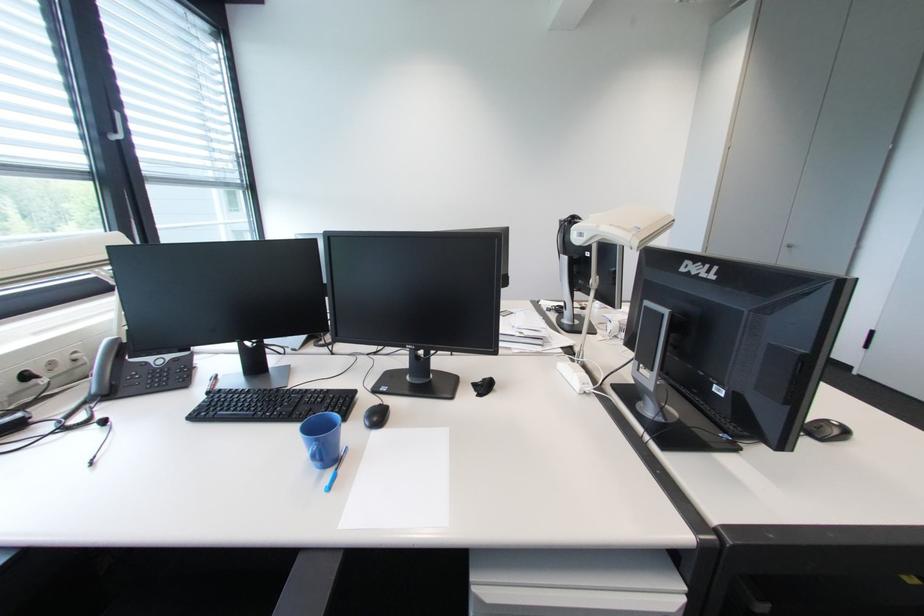
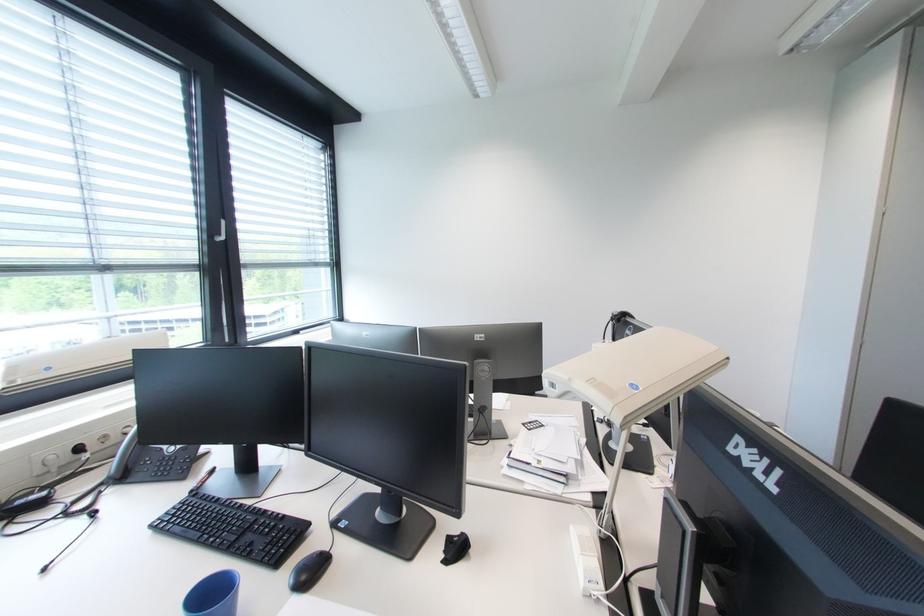
Locate, in the second image, the point that corresponds to the point at 334,392 in the first image.

(290, 517)